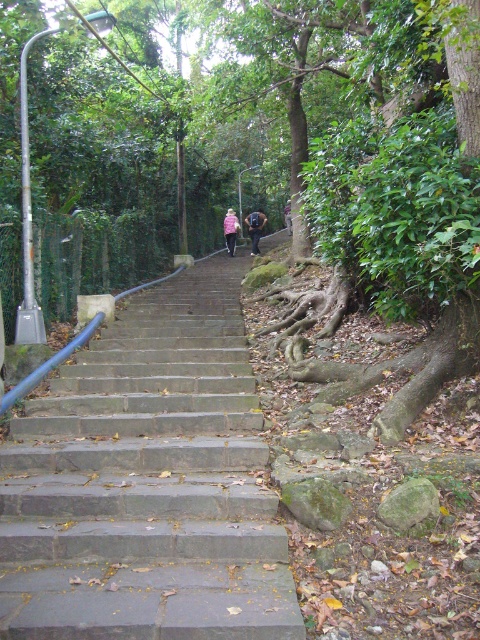
You are standing at the bottom of the stone staircase in the forest. You notice a pink fabric at upper center. Based on its coordinates, can you determine if it is closer to the left or right side of the staircase?

The pink fabric at upper center is located at coordinates point (254, 228). Since the x coordinate is 0.358, which is less than 0.5, it is closer to the left side of the staircase.

You are a hiker carrying a dark pink fabric at center and need to climb the gray concrete stairs at center. Which object is on the right side when facing the stairs?

The dark pink fabric at center is on the right side when facing the stairs because the gray concrete stairs at center is positioned on the left side of dark pink fabric at center.

You are planning to place a new bench in the forest scene. The bench must be placed between the pink fabric at upper center and the dark pink fabric at center. Given their sizes, which fabric area would allow the bench to be placed closer to it?

The dark pink fabric at center occupies more space than the pink fabric at upper center, so placing the bench closer to the dark pink fabric at center would be more appropriate due to its larger area.